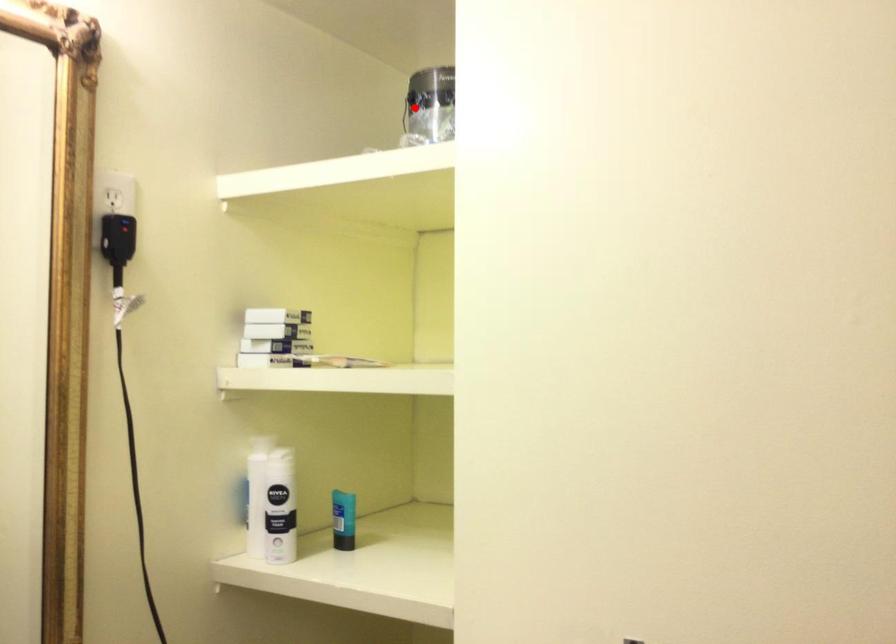
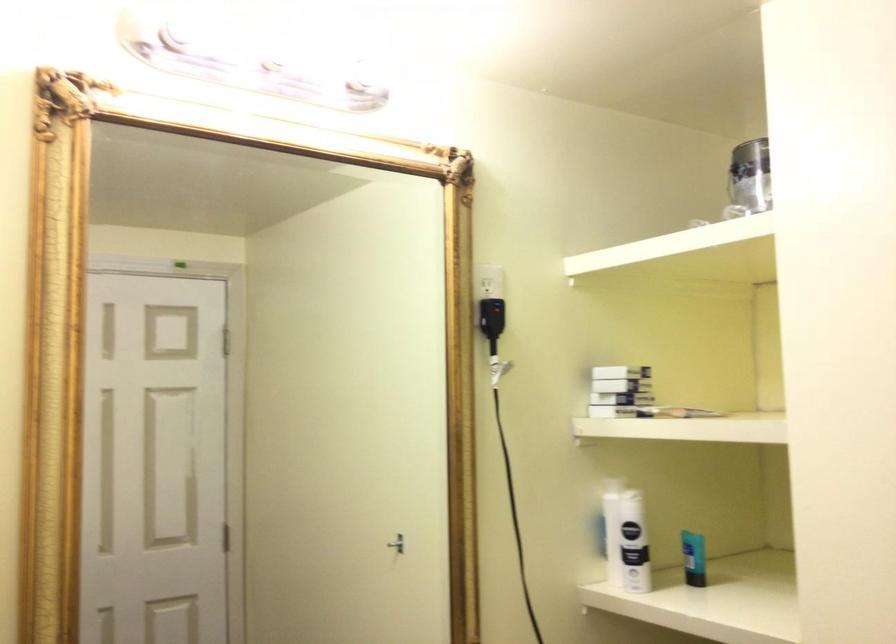
In the second image, find the point that corresponds to the highlighted location in the first image.

(750, 178)